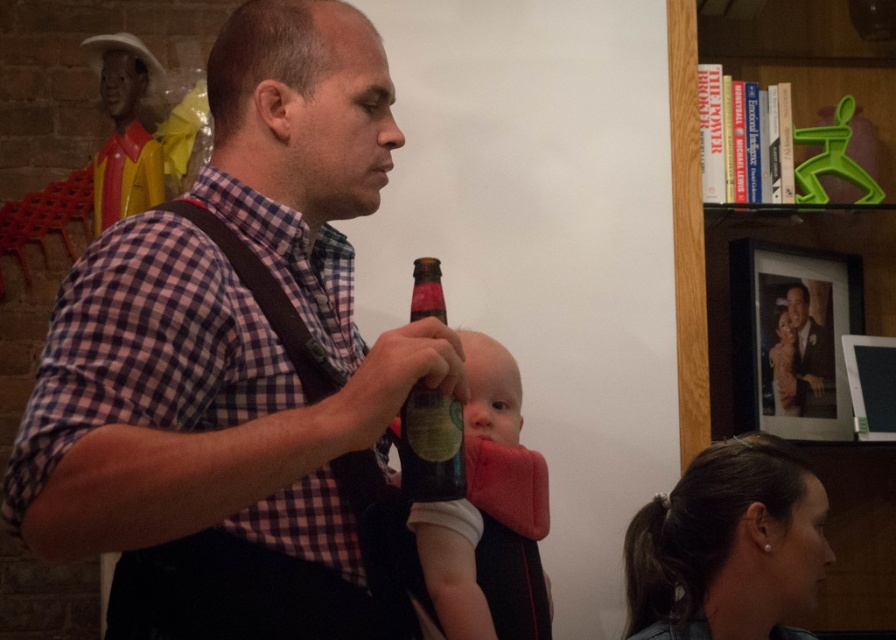
You are a tailor measuring a man for a new suit. You need to ensure the jacket will fit over his existing clothing. The man is wearing a matte plaid shirt at center and brown leather suspenders at left. Given that the distance between these two items is 4.30 inches, will the jacket need to accommodate this spacing?

The matte plaid shirt at center is 4.30 inches away from the brown leather suspenders at left. Therefore, the jacket must be tailored to allow for this 4.30 inch gap between the shirt and suspenders to ensure a proper fit.

You are standing at the center of the room and want to reach the bookshelf in the background. There is a point at coordinates (x=229, y=321) which has a matte plaid shirt. Is the bookshelf closer to you than that point?

The matte plaid shirt at center is located at point (x=229, y=321). Since the bookshelf is in the background, it is farther away from you than the point with the matte plaid shirt.